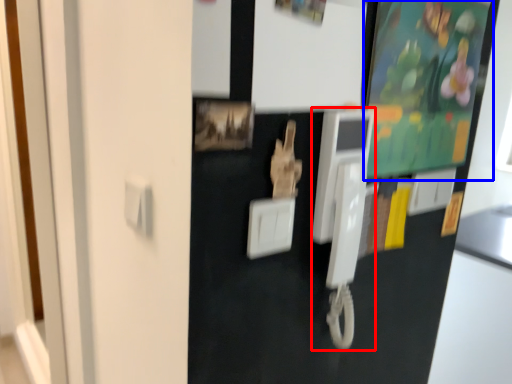
Question: Which of the following is the farthest to the observer, payphone (highlighted by a red box) or bulletin board (highlighted by a blue box)?

Choices:
 (A) payphone
 (B) bulletin board

Answer: (B)